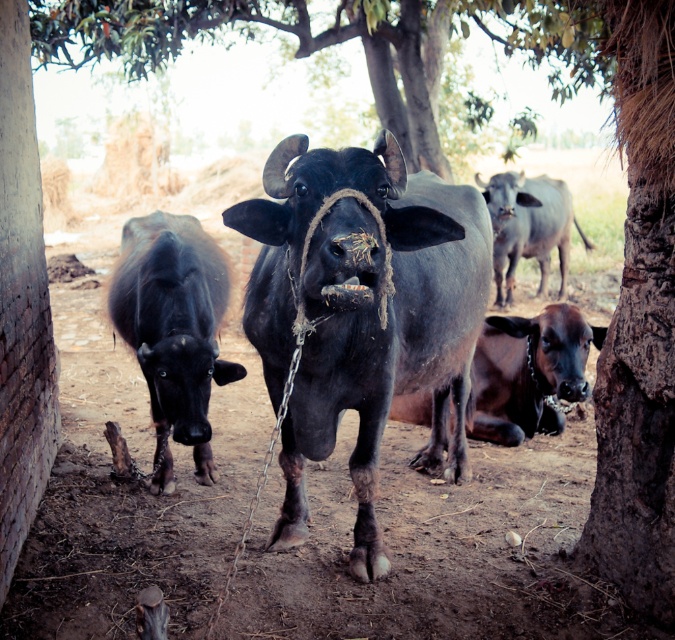
Question: Considering the relative positions of green leafy tree at upper center and brown matte cow at lower right in the image provided, where is green leafy tree at upper center located with respect to brown matte cow at lower right?

Choices:
 (A) left
 (B) right

Answer: (A)

Question: Can you confirm if shiny black yak at center is smaller than smooth gray bull at upper right?

Choices:
 (A) no
 (B) yes

Answer: (B)

Question: Which is nearer to the shiny black yak at center?

Choices:
 (A) brown matte cow at lower right
 (B) smooth gray bull at upper right
 (C) green leafy tree at upper center
 (D) shiny black bull at center

Answer: (D)

Question: Does shiny black yak at center have a lesser width compared to smooth gray bull at upper right?

Choices:
 (A) no
 (B) yes

Answer: (B)

Question: Based on their relative distances, which object is farther from the smooth gray bull at upper right?

Choices:
 (A) brown matte cow at lower right
 (B) shiny black bull at center
 (C) shiny black yak at center
 (D) green leafy tree at upper center

Answer: (C)

Question: Among these objects, which one is nearest to the camera?

Choices:
 (A) smooth gray bull at upper right
 (B) shiny black bull at center

Answer: (B)